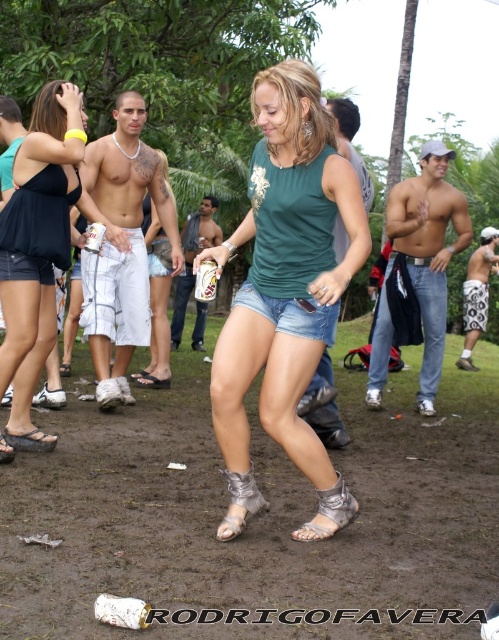
You are a photographer trying to capture the scene. You want to ensure that the matte black tank top at upper left is centered in your photo. Given its current position at coordinates, what adjustment should you make to the camera to center it?

To center the matte black tank top at upper left, adjust the camera so that its position aligns with the center coordinates of the image. Since the current coordinates are at point (36, 252), move the camera slightly to the right and down to bring the object to the center.